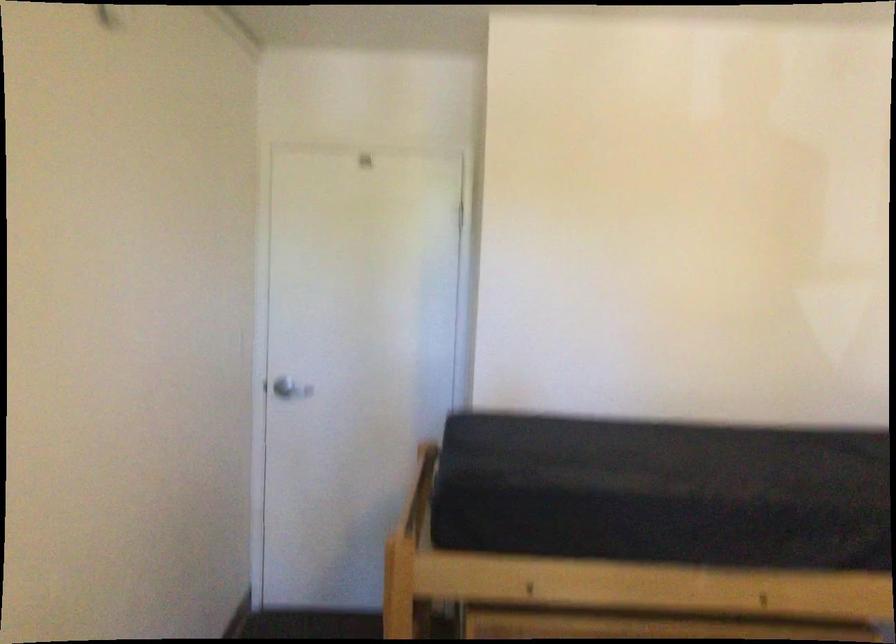
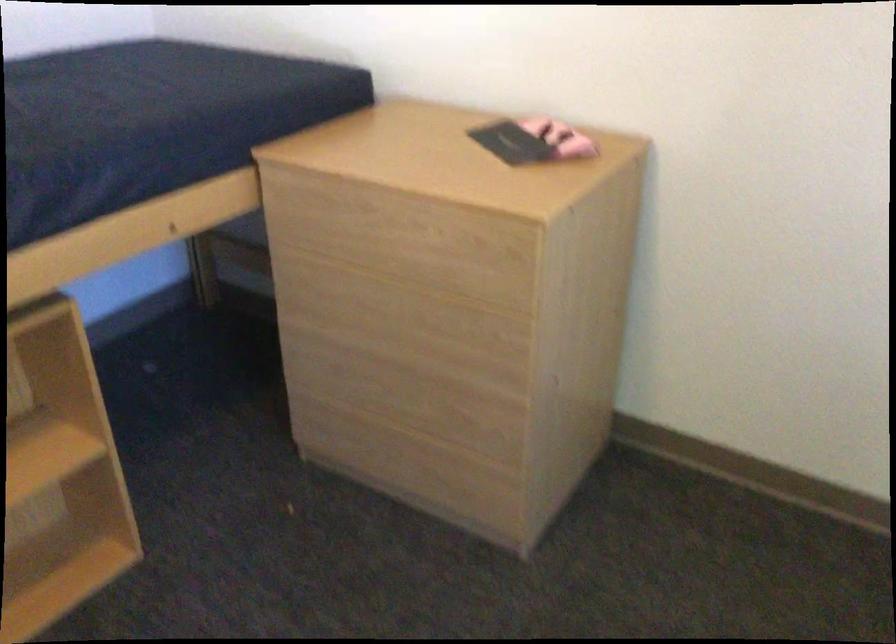
Based on the continuous images, in which direction is the camera rotating?

The camera rotated toward right-down.